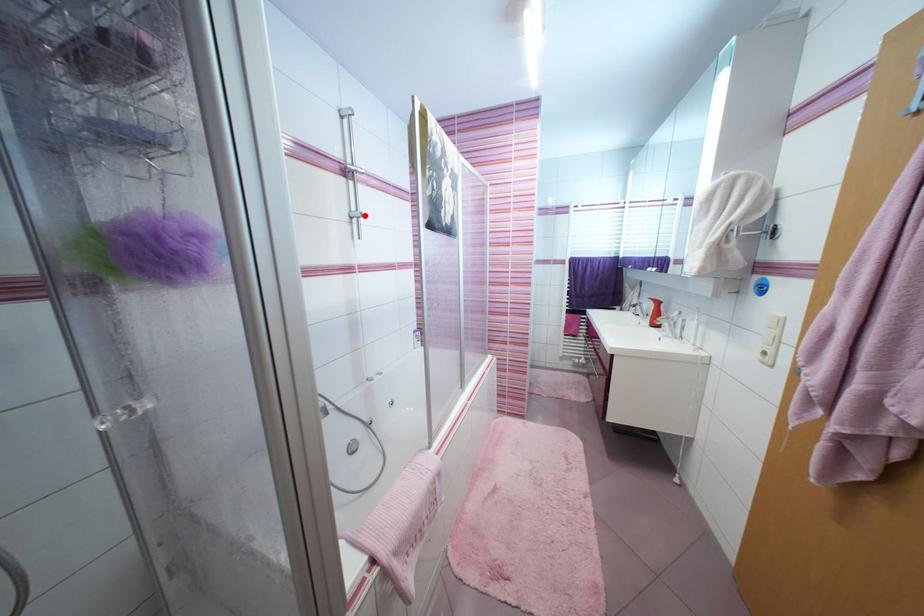
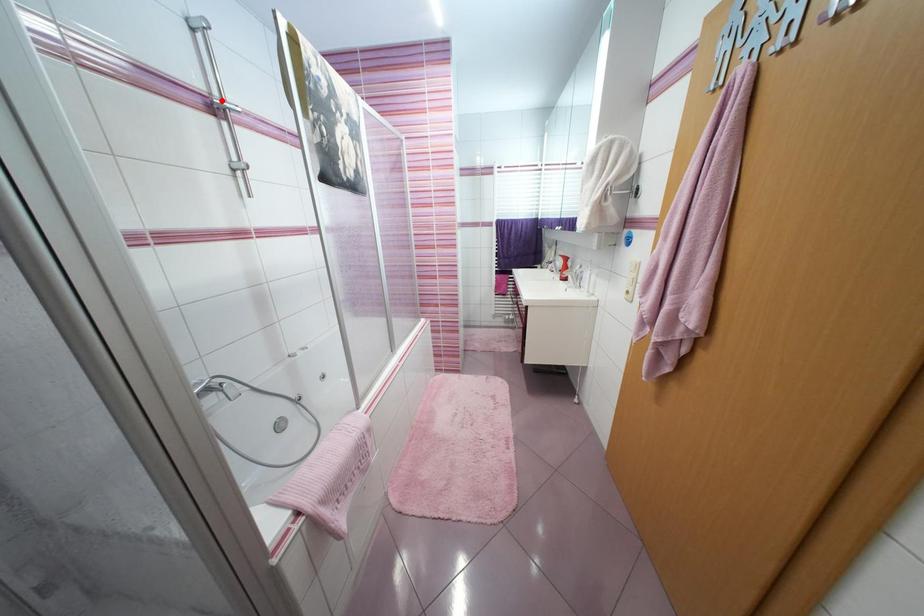
I am providing you with two images of the same scene from different viewpoints. A red point is marked on the first image and another point is marked on the second image. Is the red point in image1 aligned with the point shown in image2?

No